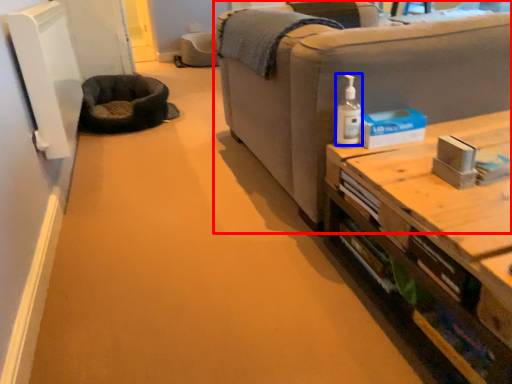
Question: Which object is closer to the camera taking this photo, studio couch (highlighted by a red box) or toiletry (highlighted by a blue box)?

Choices:
 (A) studio couch
 (B) toiletry

Answer: (A)